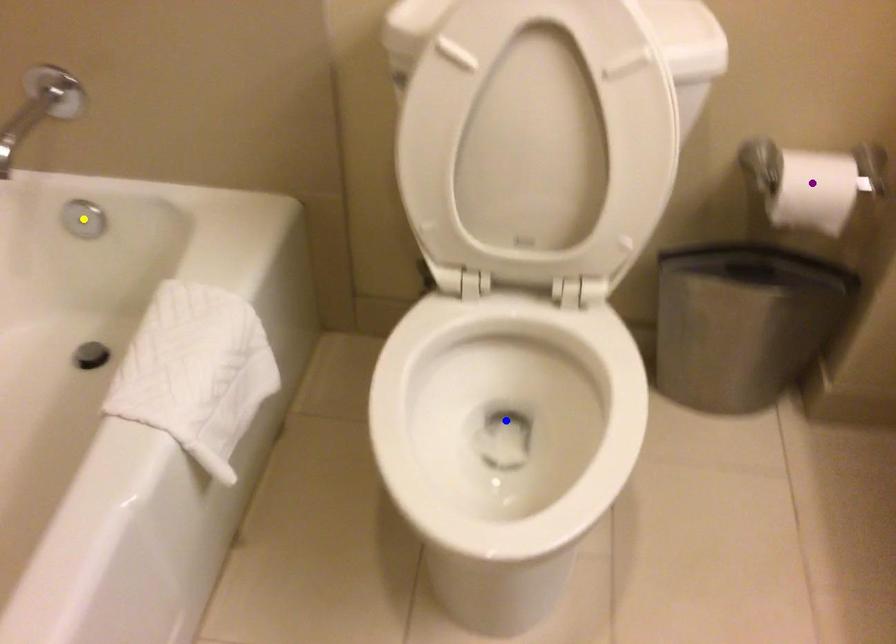
Based on the photo, order these from nearest to farthest:
1. yellow point
2. blue point
3. purple point

blue point
purple point
yellow point